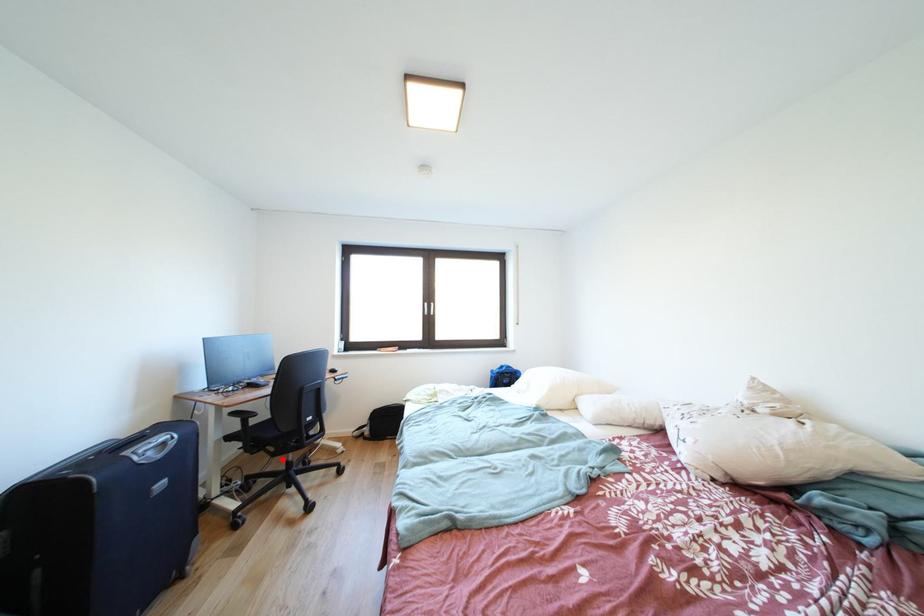
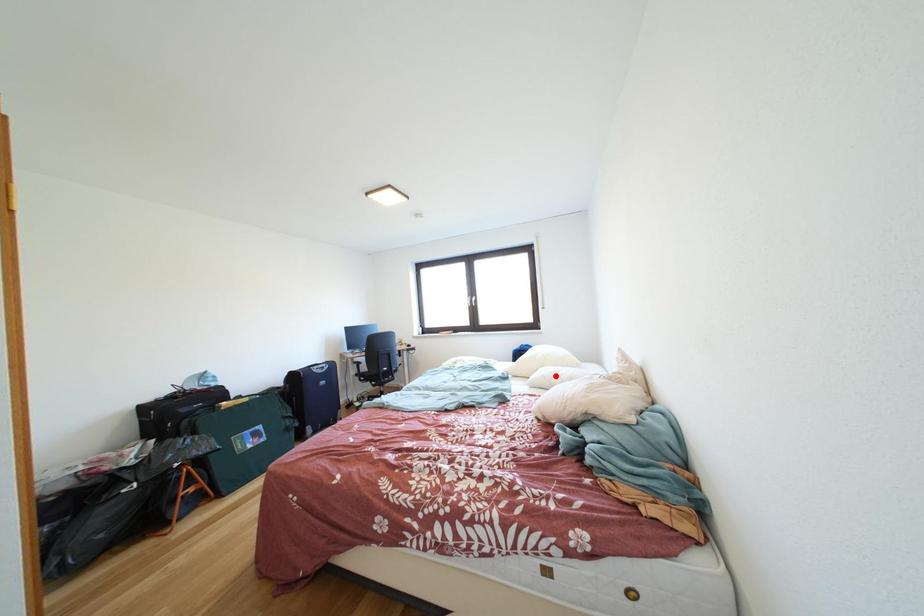
I am providing you with two images of the same scene from different viewpoints. A red point is marked on the first image and another point is marked on the second image. Does the point marked in image1 correspond to the same location as the one in image2?

No